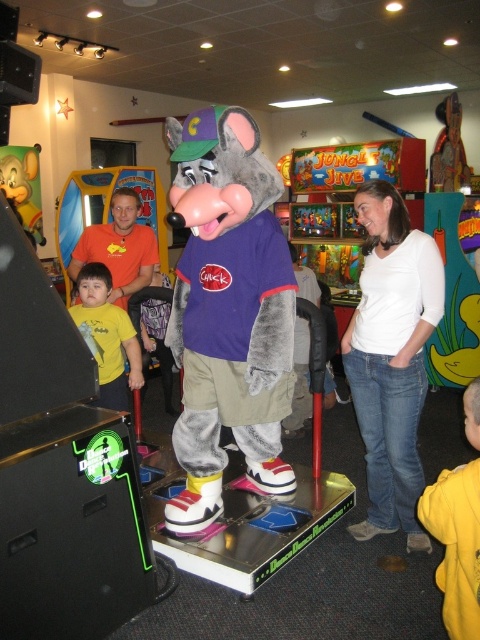
Question: Can you confirm if plush gray mouse at center is wider than matte yellow plush mouse at left?

Choices:
 (A) no
 (B) yes

Answer: (B)

Question: Does plush gray mouse at center appear under yellow matte shirt at left?

Choices:
 (A) yes
 (B) no

Answer: (B)

Question: Which is farther from the white cotton shirt at center?

Choices:
 (A) yellow fleece jacket at lower right
 (B) yellow matte shirt at left
 (C) plush gray mouse at center

Answer: (B)

Question: Is white cotton shirt at center behind yellow matte shirt at left?

Choices:
 (A) no
 (B) yes

Answer: (A)

Question: Which point is closer to the camera?

Choices:
 (A) plush gray mouse at center
 (B) yellow matte shirt at left
 (C) yellow fleece jacket at lower right
 (D) white cotton shirt at center

Answer: (C)

Question: Estimate the real-world distances between objects in this image. Which object is closer to the yellow matte shirt at left?

Choices:
 (A) white cotton shirt at center
 (B) matte yellow plush mouse at left

Answer: (A)